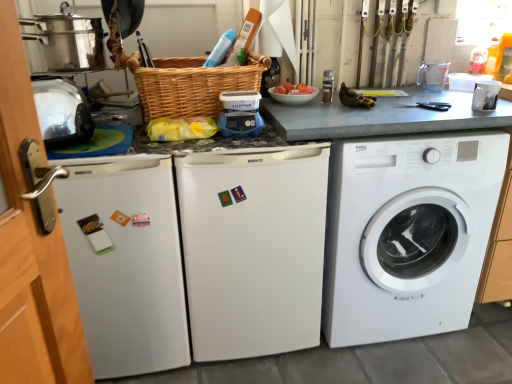
Where is `free spot behind white glossy mug at upper right, the 1th appliance positioned from the right`? The height and width of the screenshot is (384, 512). free spot behind white glossy mug at upper right, the 1th appliance positioned from the right is located at coordinates click(x=441, y=93).